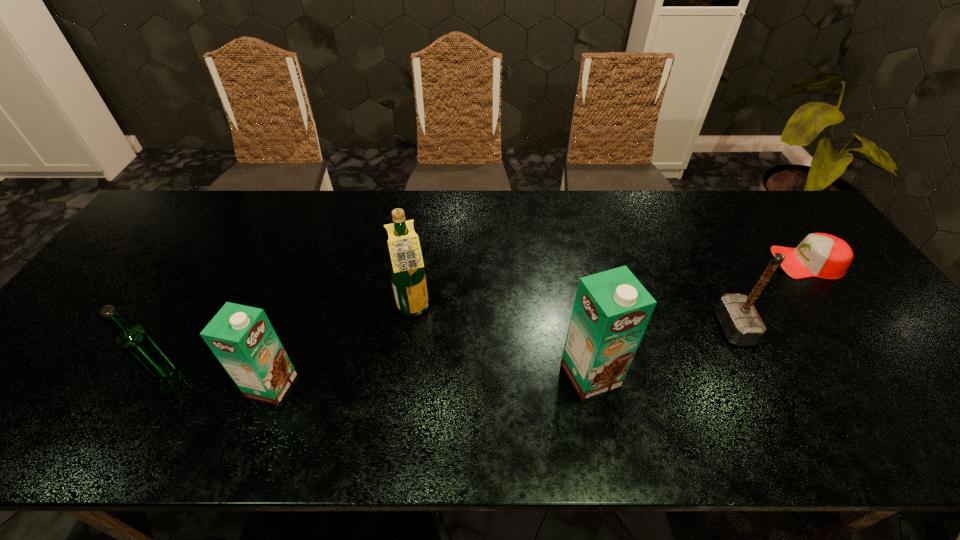
This screenshot has height=540, width=960. Identify the location of the shorter carton. (242, 338).

Find the location of a particular element. the left carton is located at coordinates (242, 338).

You are a GUI agent. You are given a task and a screenshot of the screen. Output one action in this format:
    pyautogui.click(x=<x>, y=<y>)
    Task: Click on the right carton
    
    Given the screenshot: What is the action you would take?
    pyautogui.click(x=611, y=310)

The height and width of the screenshot is (540, 960). What are the coordinates of `the fourth object from left to right` in the screenshot? It's located at (611, 310).

Identify the location of hammer. Image resolution: width=960 pixels, height=540 pixels. (740, 321).

Locate an element on the screen. liquor is located at coordinates (407, 271).

I want to click on baseball cap, so click(822, 255).

You are a GUI agent. You are given a task and a screenshot of the screen. Output one action in this format:
    pyautogui.click(x=<x>, y=<y>)
    Task: Click on the shortest object
    
    Given the screenshot: What is the action you would take?
    pyautogui.click(x=822, y=255)

This screenshot has height=540, width=960. Find the location of `the leftmost object`. the leftmost object is located at coordinates tap(135, 341).

The image size is (960, 540). Find the location of `free space located 0.340m on the right of the left carton`. free space located 0.340m on the right of the left carton is located at coordinates (442, 386).